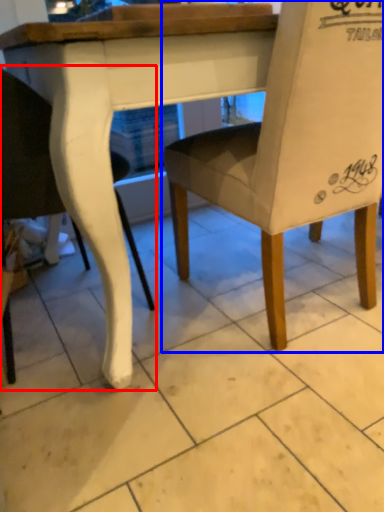
Question: Which object appears farthest to the camera in this image, chair (highlighted by a red box) or chair (highlighted by a blue box)?

Choices:
 (A) chair
 (B) chair

Answer: (A)